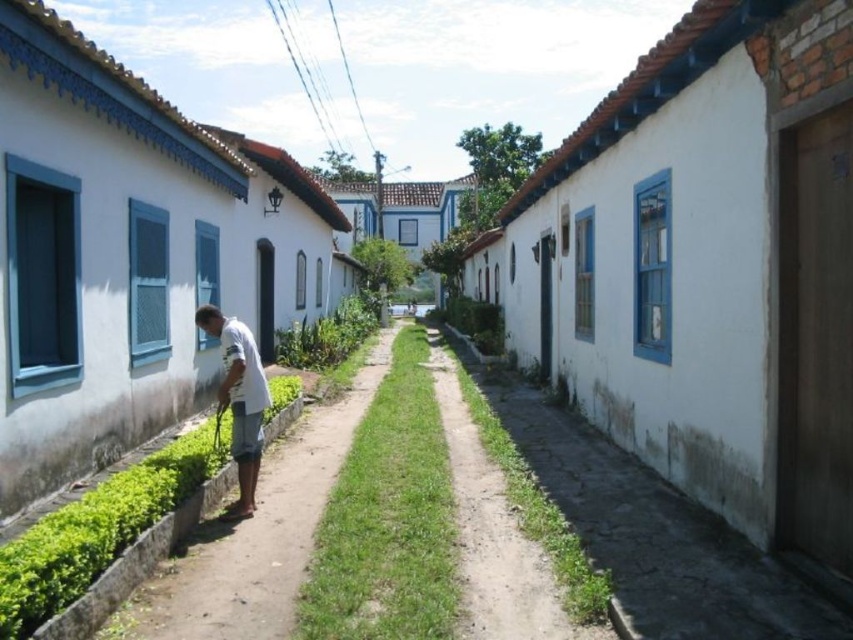
You are navigating through the narrow alleyway described. There is a white matte man at center. Can you pass safely on either side of him without stepping on the grass strip in the middle?

The alley has a grass strip in the middle, so you can go around the white matte man at center on either side of the alley without stepping on the grass. The path on the stone side and the greenery side should allow passage.

You are a delivery person with a cart that is 1.2 meters wide. You need to navigate through the narrow alleyway shown in the image. Can your cart fit through the white rough concrete path at lower right without touching the white matte man at center?

The white rough concrete path at lower right is wider than the white matte man at center, so the cart can fit through the path as long as it stays centered and avoids the man.